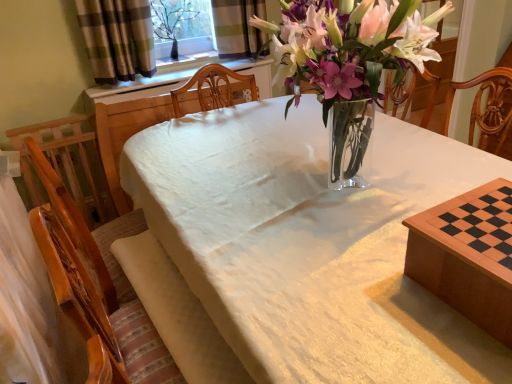
Question: Can you confirm if wooden chessboard at lower right, the 1th table positioned from the back, is smaller than plaid fabric curtain at upper left?

Choices:
 (A) no
 (B) yes

Answer: (B)

Question: Is wooden chessboard at lower right, the 1th table positioned from the back, taller than plaid fabric curtain at upper left?

Choices:
 (A) no
 (B) yes

Answer: (A)

Question: Is plaid fabric curtain at upper left at the back of wooden chessboard at lower right, the 2th table in the front-to-back sequence?

Choices:
 (A) no
 (B) yes

Answer: (A)

Question: Considering the relative positions of wooden chessboard at lower right, the 1th table positioned from the back, and plaid fabric curtain at upper left in the image provided, is wooden chessboard at lower right, the 1th table positioned from the back, to the right of plaid fabric curtain at upper left from the viewer's perspective?

Choices:
 (A) yes
 (B) no

Answer: (A)

Question: From the image's perspective, would you say wooden chessboard at lower right, the 2th table in the front-to-back sequence, is positioned over plaid fabric curtain at upper left?

Choices:
 (A) yes
 (B) no

Answer: (B)

Question: In terms of size, does wooden chessboard at lower right, the 2th table in the front-to-back sequence, appear bigger or smaller than plaid fabric curtain at upper left?

Choices:
 (A) small
 (B) big

Answer: (A)

Question: From a real-world perspective, relative to plaid fabric curtain at upper left, is wooden chessboard at lower right, the 1th table positioned from the back, vertically above or below?

Choices:
 (A) above
 (B) below

Answer: (B)

Question: Is wooden chessboard at lower right, the 2th table in the front-to-back sequence, inside the boundaries of plaid fabric curtain at upper left, or outside?

Choices:
 (A) outside
 (B) inside

Answer: (A)

Question: Is wooden chessboard at lower right, the 1th table positioned from the back, taller or shorter than plaid fabric curtain at upper left?

Choices:
 (A) short
 (B) tall

Answer: (A)

Question: Looking at the image, does plaid fabric curtain at upper left seem bigger or smaller compared to wooden chessboard at lower right, the 2th table in the front-to-back sequence?

Choices:
 (A) big
 (B) small

Answer: (A)

Question: From the image's perspective, relative to wooden chessboard at lower right, the 2th table in the front-to-back sequence, is plaid fabric curtain at upper left above or below?

Choices:
 (A) above
 (B) below

Answer: (A)

Question: From a real-world perspective, is plaid fabric curtain at upper left physically located above or below wooden chessboard at lower right, the 1th table positioned from the back?

Choices:
 (A) below
 (B) above

Answer: (B)

Question: Would you say plaid fabric curtain at upper left is inside or outside wooden chessboard at lower right, the 1th table positioned from the back?

Choices:
 (A) outside
 (B) inside

Answer: (A)

Question: From a real-world perspective, is wooden chessboard at lower right, the 2th table in the front-to-back sequence, above or below clear glass vase at upper center?

Choices:
 (A) above
 (B) below

Answer: (B)

Question: In terms of size, does wooden chessboard at lower right, the 1th table positioned from the back, appear bigger or smaller than clear glass vase at upper center?

Choices:
 (A) small
 (B) big

Answer: (A)